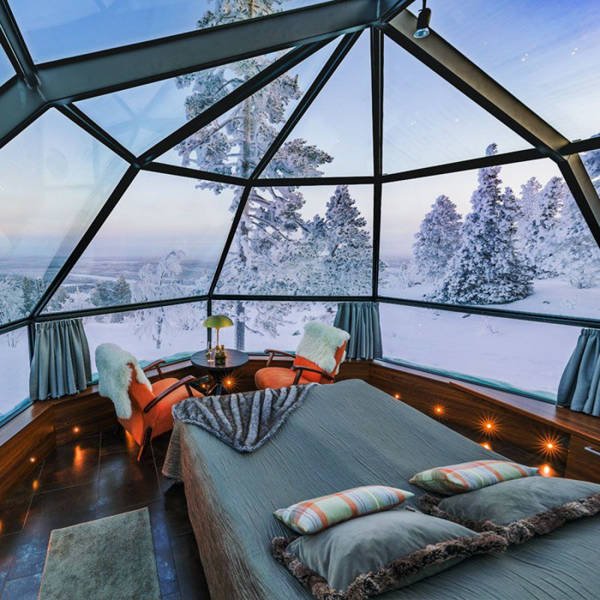
Where is `bed`? This screenshot has width=600, height=600. bed is located at coordinates (390, 459).